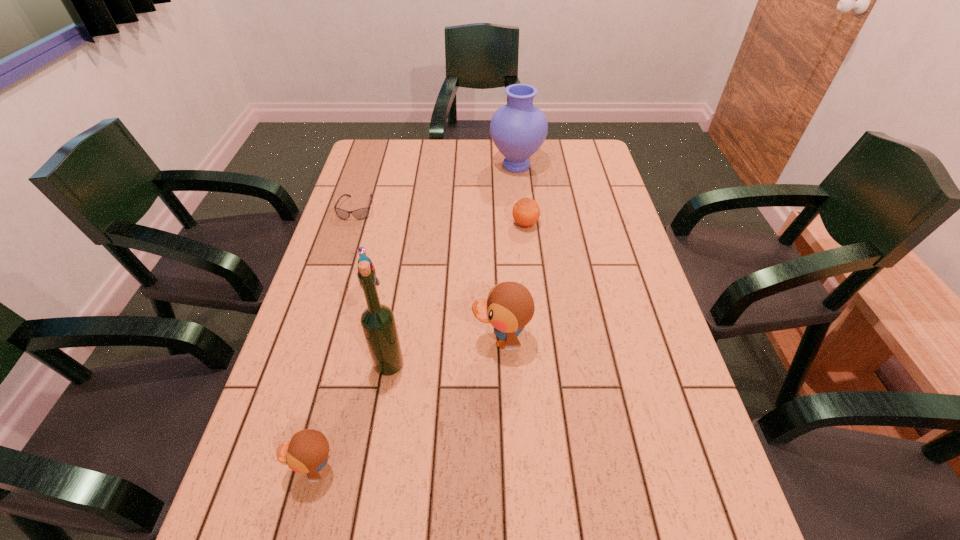
Locate an element on the screen. The height and width of the screenshot is (540, 960). the nearest object is located at coordinates (307, 451).

Identify the location of the nearer duck. (307, 451).

Where is `the taller duck`? The height and width of the screenshot is (540, 960). the taller duck is located at coordinates (509, 307).

At what (x,y) coordinates should I click in order to perform the action: click on the right duck. Please return your answer as a coordinate pair (x, y). The height and width of the screenshot is (540, 960). Looking at the image, I should click on (509, 307).

Locate an element on the screen. This screenshot has width=960, height=540. the sixth shortest object is located at coordinates (518, 129).

Locate an element on the screen. Image resolution: width=960 pixels, height=540 pixels. vase is located at coordinates (518, 129).

Identify the location of sunglasses. (362, 213).

Where is `orange`? orange is located at coordinates (526, 211).

The width and height of the screenshot is (960, 540). I want to click on soda, so click(x=361, y=251).

Where is `the fourth object from left to right`? the fourth object from left to right is located at coordinates (378, 323).